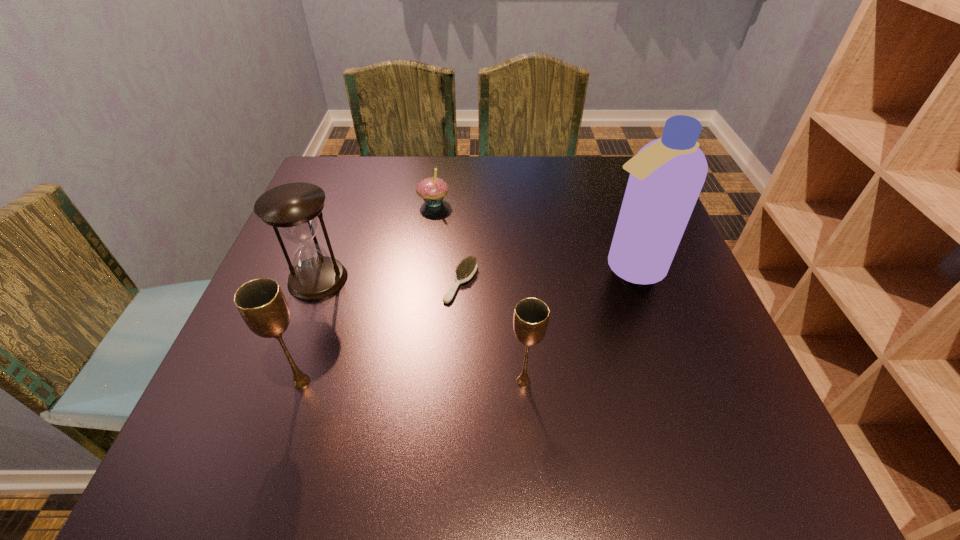
Image resolution: width=960 pixels, height=540 pixels. What are the coordinates of `blank area located 0.350m on the right of the left chalice` in the screenshot? It's located at (521, 382).

Locate an element on the screen. The width and height of the screenshot is (960, 540). free space located 0.190m on the back of the right chalice is located at coordinates (516, 291).

This screenshot has height=540, width=960. Identify the location of free space located 0.310m on the front of the third object from left to right. (420, 305).

Locate an element on the screen. The width and height of the screenshot is (960, 540). free space located on the back of the hourglass is located at coordinates (355, 177).

Image resolution: width=960 pixels, height=540 pixels. Identify the location of free location located 0.200m on the left of the shampoo. (501, 268).

Find the location of a particular element. The width and height of the screenshot is (960, 540). vacant space located on the left of the scrubbing brush is located at coordinates (288, 282).

Locate an element on the screen. object positioned at the far edge is located at coordinates (432, 190).

Where is `chalice at the left edge`? The height and width of the screenshot is (540, 960). chalice at the left edge is located at coordinates (261, 303).

The height and width of the screenshot is (540, 960). Identify the location of hourglass that is at the left edge. (294, 208).

Find the location of a particular element. Image resolution: width=960 pixels, height=540 pixels. object situated at the right edge is located at coordinates (666, 176).